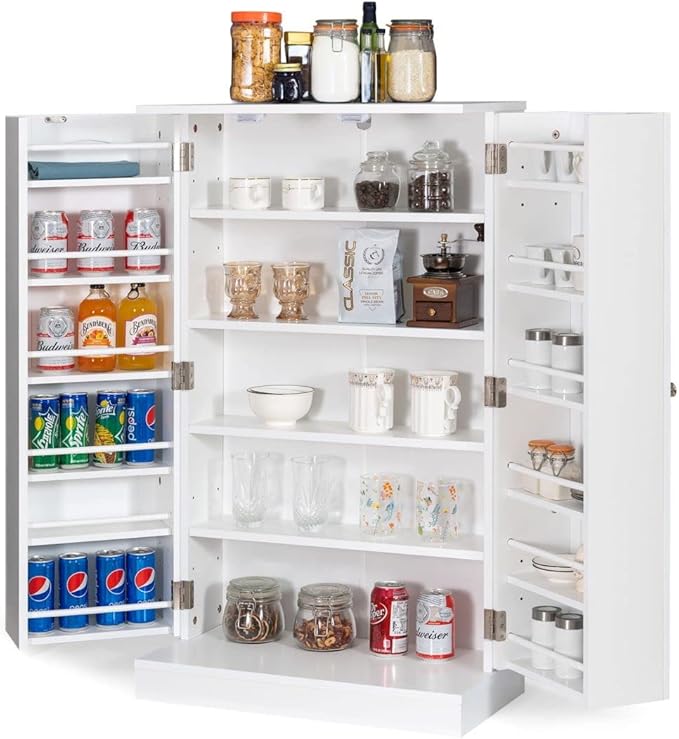
I want to click on drinking glasses, so click(242, 483), click(312, 480), click(390, 505), click(441, 505), click(234, 287), click(295, 287).